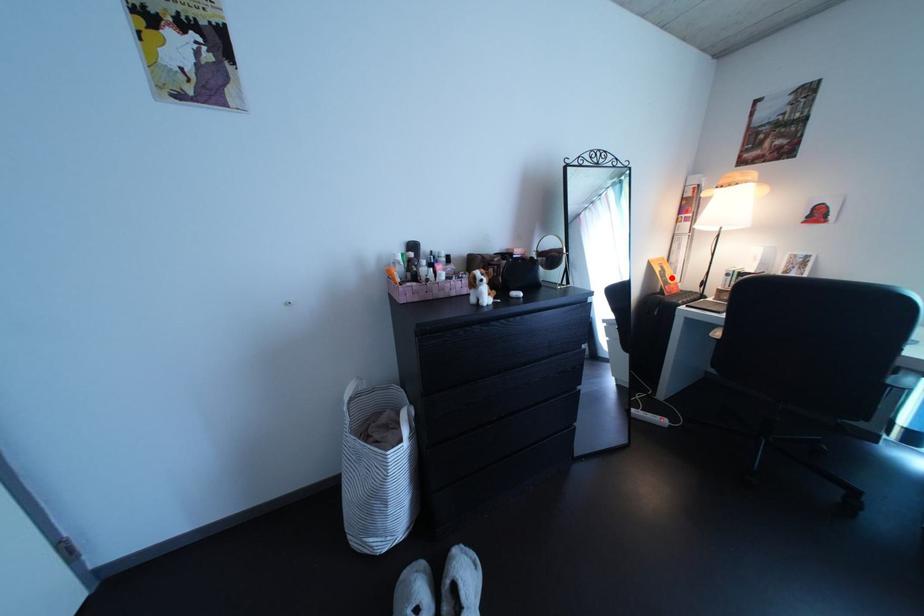
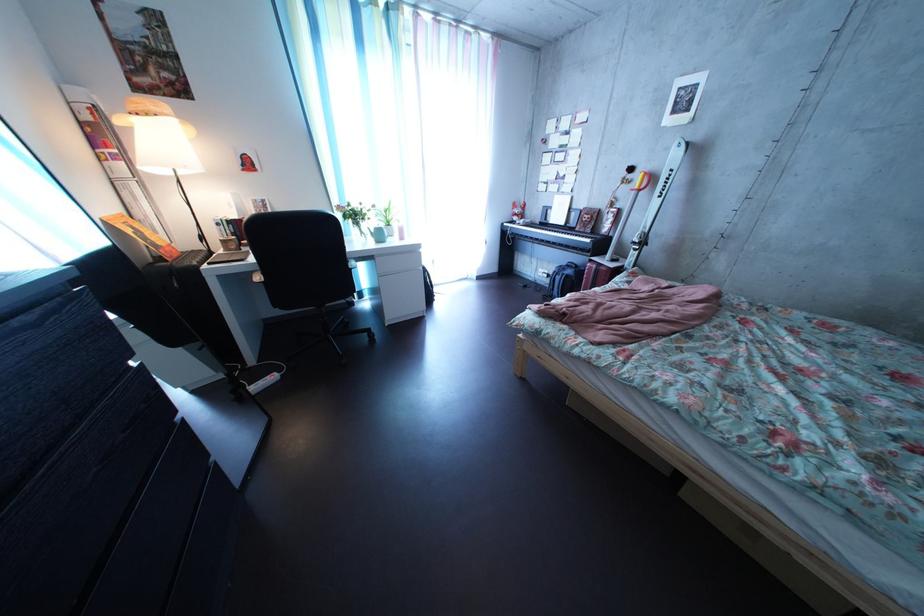
Where in the second image is the point corresponding to the highlighted location from the first image?

(142, 238)